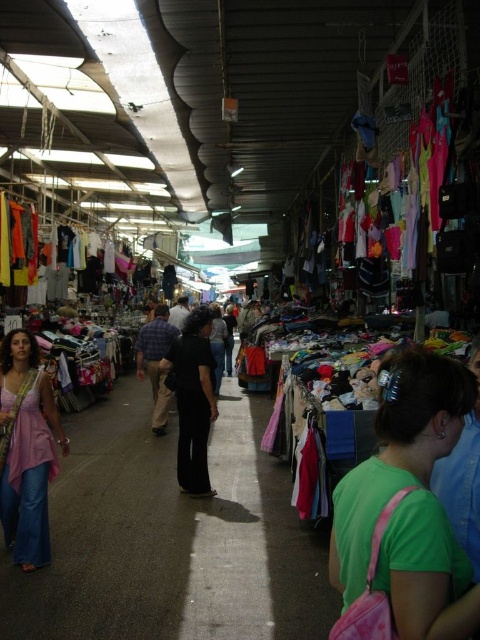
You are a customer at the market and want to buy both the matte pink dress at left and the green matte shirt at lower right. If you have a bag that can carry items up to the size of the smaller object, will you be able to fit both items into the bag?

The matte pink dress at left is bigger than the green matte shirt at lower right. Since the bag can only carry items up to the size of the smaller object, you cannot fit both items into the bag because the larger matte pink dress at left exceeds the bag size limit.

You are a customer in the market and want to pick up both the green fabric bag at lower right and the plaid fabric shirt at center. If you can carry items up to 21 feet apart, will you be able to reach both items without moving?

The green fabric bag at lower right is 20.94 feet from the plaid fabric shirt at center, so yes, you can reach both items since the distance is within your 21 feet carrying capacity.